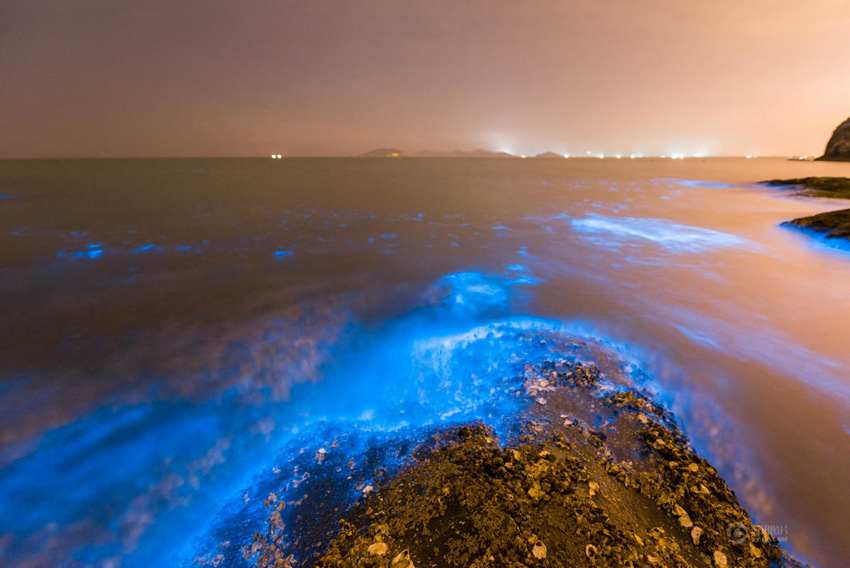
At what (x,y) coordinates should I click in order to perform the action: click on light. Please return your answer as a coordinate pair (x, y). The width and height of the screenshot is (850, 568). Looking at the image, I should click on [x=503, y=143], [x=710, y=142], [x=672, y=151].